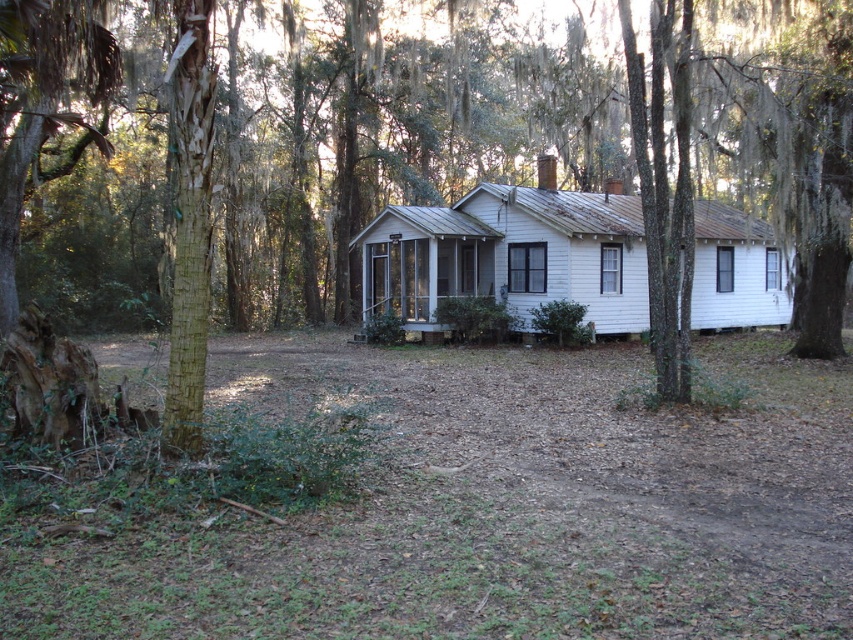
Consider the image. You are standing in front of the white wood house at center and want to see the top of the green mossy tree at center. Considering their heights, will the house block your view of the tree?

The green mossy tree at center is taller than the white wood house at center, so the house will not block your view of the tree.

You are planning to build a small garden between the green mossy tree at center and the white wood house at center. Considering their sizes, which object would require more space to accommodate the garden?

The green mossy tree at center has a larger size compared to the white wood house at center, so it would require more space to accommodate the garden.